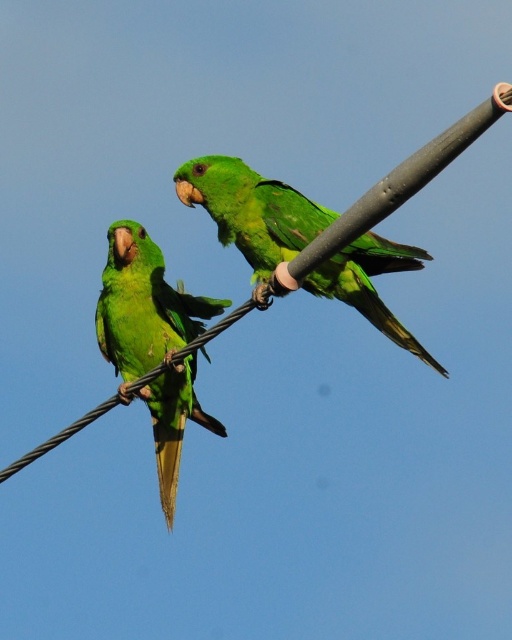
Which is more to the right, green matte parrot at center or green matte parrot at left?

Positioned to the right is green matte parrot at center.

Is point (270, 227) less distant than point (194, 349)?

Yes.

Locate an element on the screen. This screenshot has height=640, width=512. green matte parrot at center is located at coordinates (251, 212).